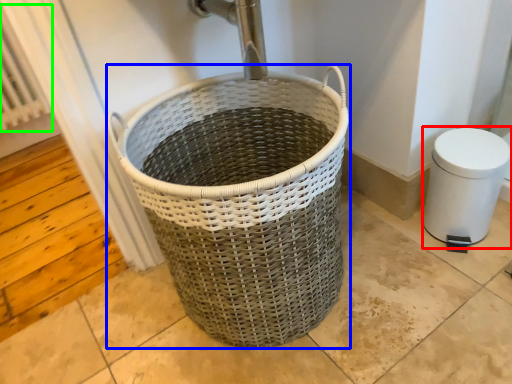
Question: Based on their relative distances, which object is nearer to bidet (highlighted by a red box)? Choose from waste container (highlighted by a blue box) and radiator (highlighted by a green box).

Choices:
 (A) waste container
 (B) radiator

Answer: (A)